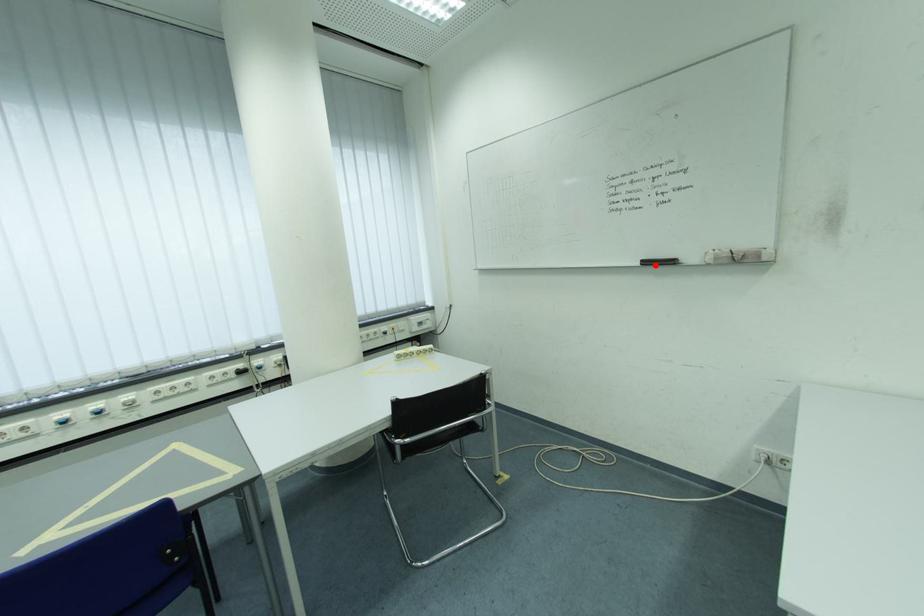
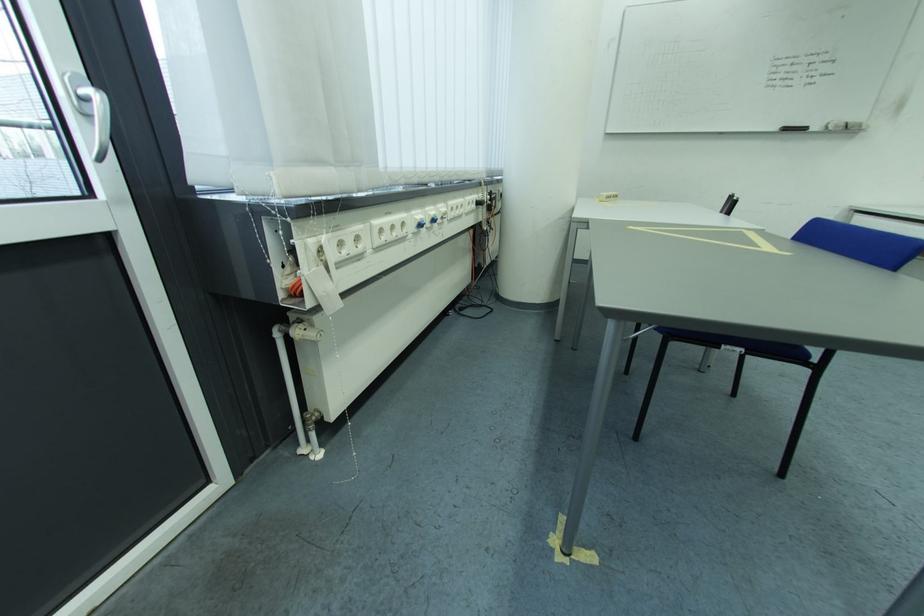
Where in the second image is the point corresponding to the highlighted location from the first image?

(796, 131)